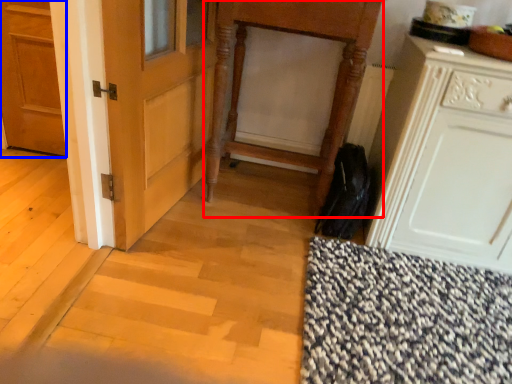
Question: Which object is further to the camera taking this photo, vanity (highlighted by a red box) or door (highlighted by a blue box)?

Choices:
 (A) vanity
 (B) door

Answer: (B)